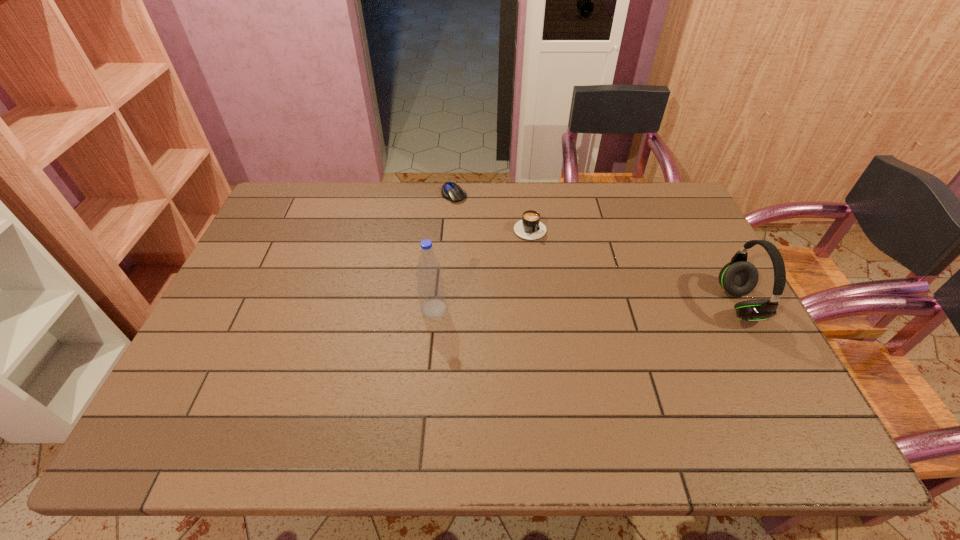
Where is `free space located 0.200m with the handle on the side of the cappuccino`? Image resolution: width=960 pixels, height=540 pixels. free space located 0.200m with the handle on the side of the cappuccino is located at coordinates (572, 282).

Identify the location of blank space located 0.180m on the button side of the shortest object. (483, 233).

I want to click on vacant space located on the button side of the shortest object, so click(x=501, y=256).

Locate an element on the screen. This screenshot has height=540, width=960. vacant space situated on the button side of the shortest object is located at coordinates (488, 239).

I want to click on cappuccino that is positioned at the far edge, so click(530, 227).

Image resolution: width=960 pixels, height=540 pixels. I want to click on computer mouse that is at the far edge, so click(x=451, y=191).

Where is `object that is at the right edge`? The image size is (960, 540). object that is at the right edge is located at coordinates (738, 278).

Identify the location of free point at the far edge. (497, 193).

Locate an element on the screen. The width and height of the screenshot is (960, 540). free location at the left edge of the desktop is located at coordinates (314, 227).

Where is `vacant space at the right edge of the desktop`? This screenshot has height=540, width=960. vacant space at the right edge of the desktop is located at coordinates (737, 336).